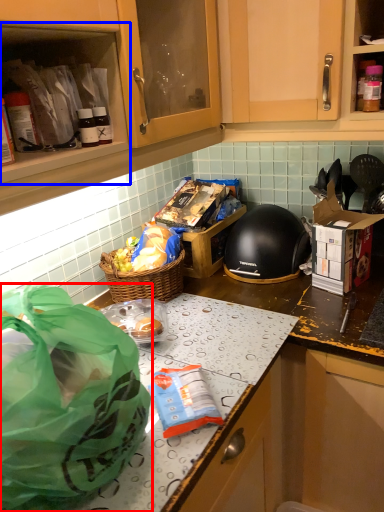
Question: Which object is further to the camera taking this photo, plastic bag (highlighted by a red box) or cabinetry (highlighted by a blue box)?

Choices:
 (A) plastic bag
 (B) cabinetry

Answer: (B)